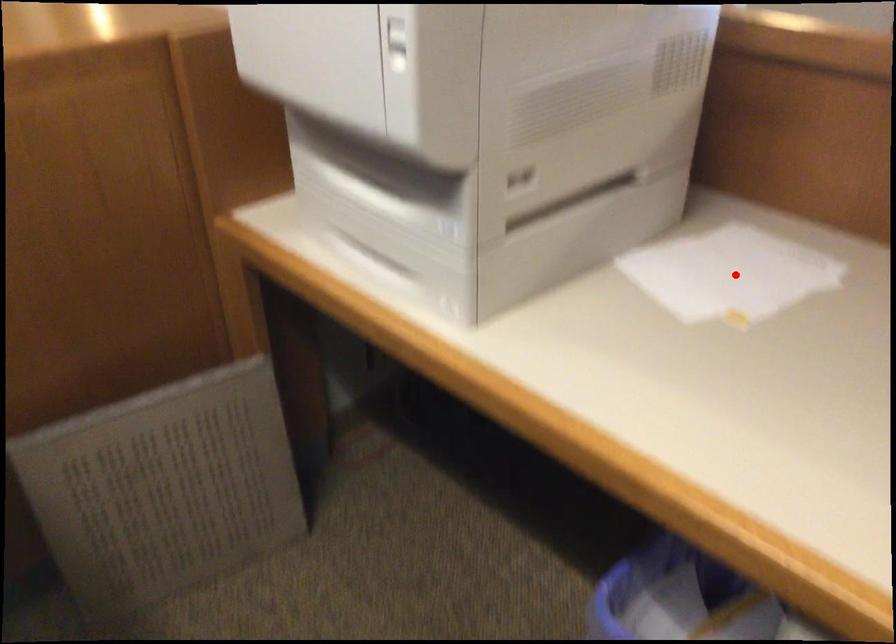
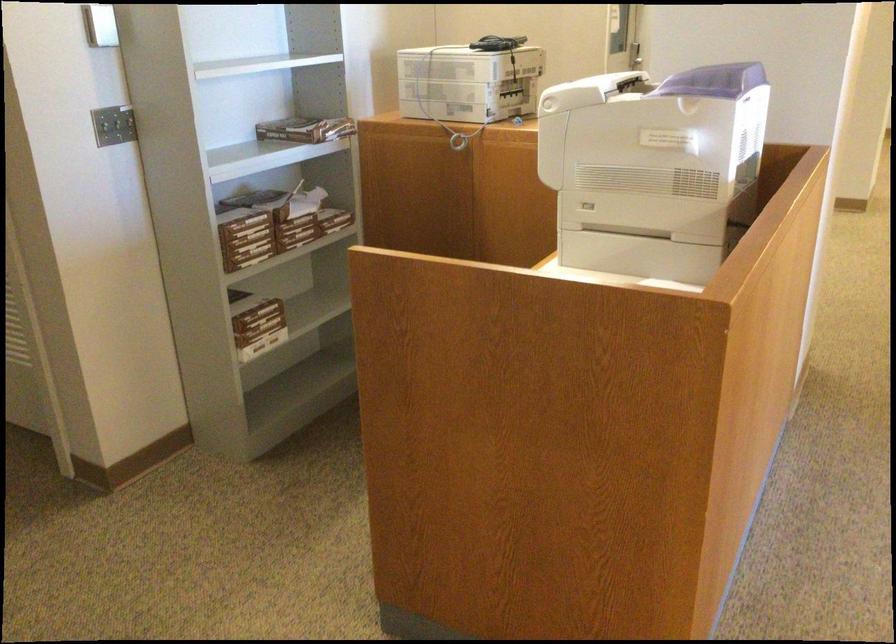
Question: I am providing you with two images of the same scene from different viewpoints. A red point is marked on the first image. Can you still see the location of the red point in image 2?

Choices:
 (A) Yes
 (B) No

Answer: (B)